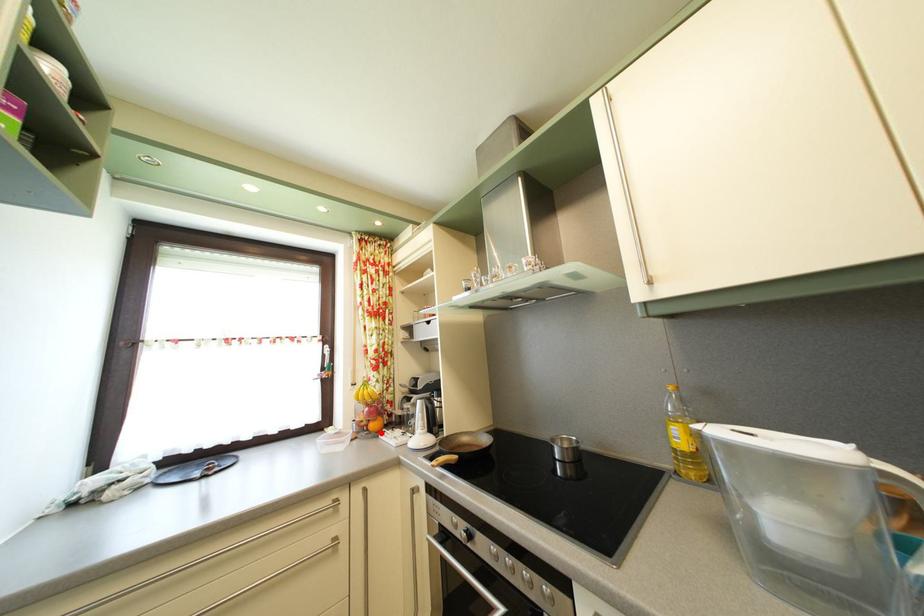
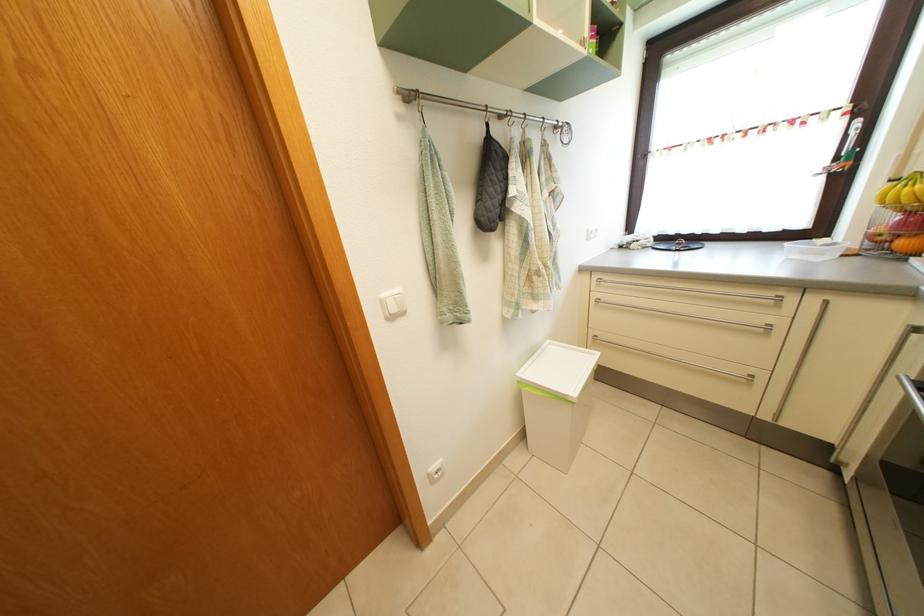
In the second image, find the point that corresponds to the highlighted location in the first image.

(910, 252)